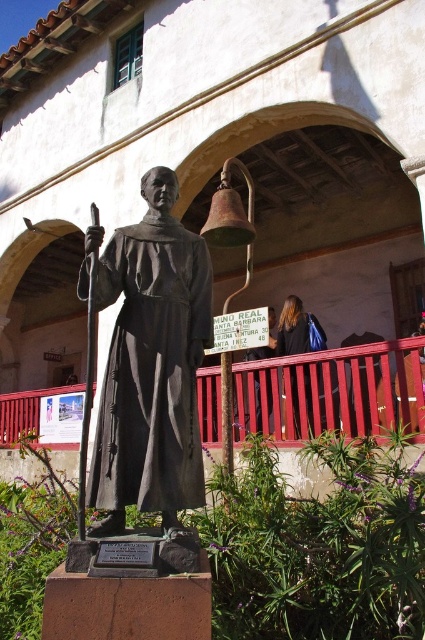
Question: Which point is farther to the camera?

Choices:
 (A) (308, 397)
 (B) (173, 227)

Answer: (A)

Question: Considering the real-world distances, which object is closest to the matte black robe at center?

Choices:
 (A) dark brown hair at upper center
 (B) blonde hair at upper right

Answer: (B)

Question: Is blonde hair at upper right closer to camera compared to dark brown hair at upper center?

Choices:
 (A) no
 (B) yes

Answer: (B)

Question: Does matte black robe at center have a lesser width compared to blonde hair at upper right?

Choices:
 (A) no
 (B) yes

Answer: (A)

Question: Which point is closer to the camera?

Choices:
 (A) dark brown hair at upper center
 (B) matte black robe at center

Answer: (B)

Question: Does matte black robe at center appear on the left side of dark brown hair at upper center?

Choices:
 (A) yes
 (B) no

Answer: (A)